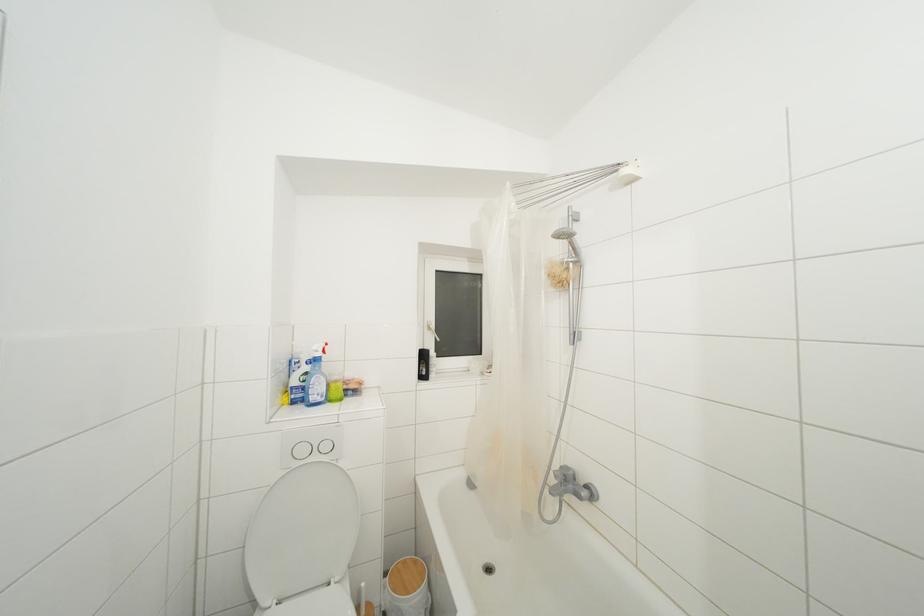
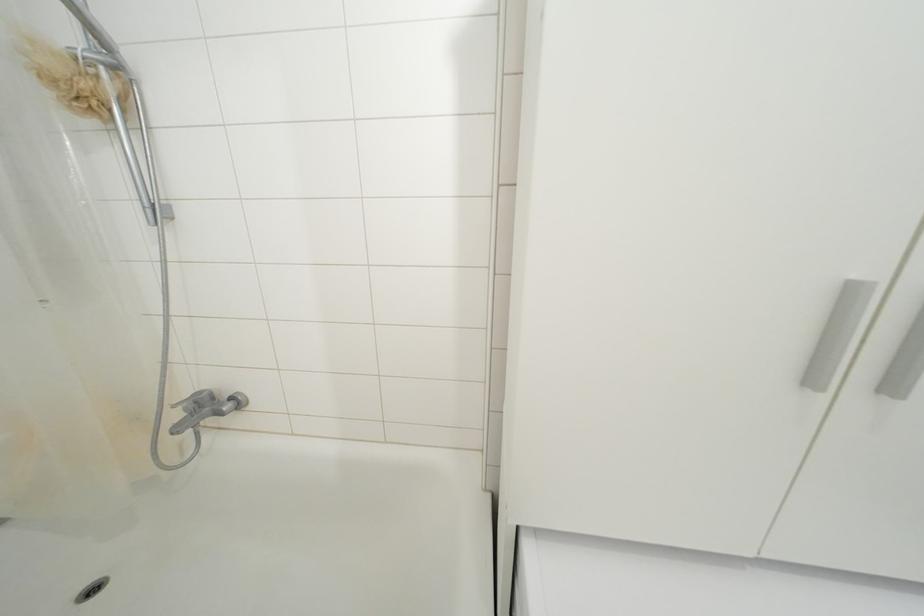
Locate, in the second image, the point that corresponds to [576,477] in the first image.

(209, 398)